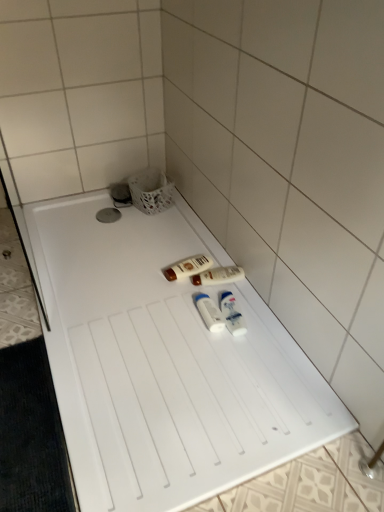
The image size is (384, 512). What are the coordinates of `white glossy lotion at center, acting as the second toiletry starting from the back` in the screenshot? It's located at (218, 276).

Is point (221, 322) closer to viewer compared to point (207, 259)?

Yes, it is.

Is white plastic tubes at center, which is counted as the second toiletry, starting from the front, positioned with its back to matte brown lotion at center, which is counted as the 4th toiletry, starting from the front?

No.

Is white plastic tubes at center, placed as the 3th toiletry when sorted from back to front, not close to matte brown lotion at center, which is counted as the 4th toiletry, starting from the front?

white plastic tubes at center, placed as the 3th toiletry when sorted from back to front, is near matte brown lotion at center, which is counted as the 4th toiletry, starting from the front, not far away.

From the image's perspective, relative to white plastic tubes at center, which is counted as the second toiletry, starting from the front, is white plastic bottles at center, the 1th toiletry from the front, above or below?

From the image's perspective, white plastic bottles at center, the 1th toiletry from the front, appears below white plastic tubes at center, which is counted as the second toiletry, starting from the front.

Between white plastic bottles at center, the 1th toiletry from the front, and white plastic tubes at center, placed as the 3th toiletry when sorted from back to front, which one has smaller size?

Smaller between the two is white plastic bottles at center, the 1th toiletry from the front.

Considering the relative positions of white plastic bottles at center, the 1th toiletry from the front, and white plastic tubes at center, which is counted as the second toiletry, starting from the front, in the image provided, is white plastic bottles at center, the 1th toiletry from the front, to the right of white plastic tubes at center, which is counted as the second toiletry, starting from the front, from the viewer's perspective?

Yes.

Consider the image. Considering the sizes of objects white plastic bottles at center, the fourth toiletry positioned from the back, and white plastic tubes at center, placed as the 3th toiletry when sorted from back to front, in the image provided, who is taller, white plastic bottles at center, the fourth toiletry positioned from the back, or white plastic tubes at center, placed as the 3th toiletry when sorted from back to front,?

white plastic tubes at center, placed as the 3th toiletry when sorted from back to front.

Is white plastic bottles at center, the 1th toiletry from the front, turned away from matte brown lotion at center, which is counted as the 4th toiletry, starting from the front?

No, white plastic bottles at center, the 1th toiletry from the front,'s orientation is not away from matte brown lotion at center, which is counted as the 4th toiletry, starting from the front.

From a real-world perspective, is white plastic bottles at center, the fourth toiletry positioned from the back, physically above matte brown lotion at center, placed as the first toiletry when sorted from back to front?

Correct, in the physical world, white plastic bottles at center, the fourth toiletry positioned from the back, is higher than matte brown lotion at center, placed as the first toiletry when sorted from back to front.

Which is closer, (242, 332) or (198, 268)?

The point (242, 332) is closer.

From the image's perspective, is white plastic tubes at center, placed as the 3th toiletry when sorted from back to front, located above or below white plastic bottles at center, the fourth toiletry positioned from the back?

From the image's perspective, white plastic tubes at center, placed as the 3th toiletry when sorted from back to front, appears above white plastic bottles at center, the fourth toiletry positioned from the back.

Is white plastic tubes at center, placed as the 3th toiletry when sorted from back to front, bigger than white plastic bottles at center, the fourth toiletry positioned from the back?

Indeed, white plastic tubes at center, placed as the 3th toiletry when sorted from back to front, has a larger size compared to white plastic bottles at center, the fourth toiletry positioned from the back.

Is white plastic tubes at center, which is counted as the second toiletry, starting from the front, further to camera compared to white plastic bottles at center, the fourth toiletry positioned from the back?

Yes, it is behind white plastic bottles at center, the fourth toiletry positioned from the back.

Is white plastic tubes at center, placed as the 3th toiletry when sorted from back to front, taller or shorter than white plastic bottles at center, the 1th toiletry from the front?

Considering their sizes, white plastic tubes at center, placed as the 3th toiletry when sorted from back to front, has more height than white plastic bottles at center, the 1th toiletry from the front.

From the picture: Is white glossy lotion at center, the third toiletry from the front, far away from matte brown lotion at center, placed as the first toiletry when sorted from back to front?

white glossy lotion at center, the third toiletry from the front, is actually quite close to matte brown lotion at center, placed as the first toiletry when sorted from back to front.

In the image, is white glossy lotion at center, the third toiletry from the front, on the left side or the right side of matte brown lotion at center, which is counted as the 4th toiletry, starting from the front?

white glossy lotion at center, the third toiletry from the front, is to the right of matte brown lotion at center, which is counted as the 4th toiletry, starting from the front.

Who is shorter, white glossy lotion at center, the third toiletry from the front, or matte brown lotion at center, which is counted as the 4th toiletry, starting from the front?

With less height is matte brown lotion at center, which is counted as the 4th toiletry, starting from the front.

Is white glossy lotion at center, acting as the second toiletry starting from the back, smaller than matte brown lotion at center, which is counted as the 4th toiletry, starting from the front?

No.

Is the depth of white plastic tray at center less than that of white plastic bottles at center, the 1th toiletry from the front?

Yes, white plastic tray at center is closer to the camera.

How distant is white plastic tray at center from white plastic bottles at center, the 1th toiletry from the front?

They are 33.56 centimeters apart.

Is white plastic tray at center wider than white plastic bottles at center, the 1th toiletry from the front?

Correct, the width of white plastic tray at center exceeds that of white plastic bottles at center, the 1th toiletry from the front.

Does white plastic tray at center touch white plastic bottles at center, the fourth toiletry positioned from the back?

No.

From the image's perspective, which one is positioned lower, matte brown lotion at center, which is counted as the 4th toiletry, starting from the front, or white plastic tubes at center, which is counted as the second toiletry, starting from the front?

white plastic tubes at center, which is counted as the second toiletry, starting from the front, is shown below in the image.

Between matte brown lotion at center, placed as the first toiletry when sorted from back to front, and white plastic tubes at center, placed as the 3th toiletry when sorted from back to front, which one is positioned in front?

white plastic tubes at center, placed as the 3th toiletry when sorted from back to front, is closer to the camera.

Is matte brown lotion at center, placed as the first toiletry when sorted from back to front, turned away from white plastic tubes at center, which is counted as the second toiletry, starting from the front?

That's not correct — matte brown lotion at center, placed as the first toiletry when sorted from back to front, is not looking away from white plastic tubes at center, which is counted as the second toiletry, starting from the front.

From a real-world perspective, relative to white plastic tubes at center, placed as the 3th toiletry when sorted from back to front, is matte brown lotion at center, which is counted as the 4th toiletry, starting from the front, vertically above or below?

matte brown lotion at center, which is counted as the 4th toiletry, starting from the front, is below white plastic tubes at center, placed as the 3th toiletry when sorted from back to front.

From the matte brown lotion at center, placed as the first toiletry when sorted from back to front, count 1st toiletry to the right and point to it. Please provide its 2D coordinates.

[(209, 312)]

The width and height of the screenshot is (384, 512). I want to click on toiletry positioned vertically above the white plastic bottles at center, the fourth toiletry positioned from the back (from a real-world perspective), so click(209, 312).

When comparing their distances from white glossy lotion at center, the third toiletry from the front, does white plastic tray at center or white plastic tubes at center, placed as the 3th toiletry when sorted from back to front, seem further?

white plastic tray at center.

When comparing their distances from white plastic tubes at center, placed as the 3th toiletry when sorted from back to front, does white glossy lotion at center, acting as the second toiletry starting from the back, or matte brown lotion at center, placed as the first toiletry when sorted from back to front, seem further?

matte brown lotion at center, placed as the first toiletry when sorted from back to front, lies further to white plastic tubes at center, placed as the 3th toiletry when sorted from back to front, than the other object.

Which object lies further to the anchor point white plastic tray at center, white plastic bottles at center, the 1th toiletry from the front, or white glossy lotion at center, the third toiletry from the front?

white glossy lotion at center, the third toiletry from the front, lies further to white plastic tray at center than the other object.

Looking at the image, which one is located further to white plastic bottles at center, the fourth toiletry positioned from the back, white plastic tubes at center, placed as the 3th toiletry when sorted from back to front, or white plastic tray at center?

Based on the image, white plastic tray at center appears to be further to white plastic bottles at center, the fourth toiletry positioned from the back.

Looking at the image, which one is located further to matte brown lotion at center, which is counted as the 4th toiletry, starting from the front, white plastic tubes at center, which is counted as the second toiletry, starting from the front, or white plastic bottles at center, the 1th toiletry from the front?

The object further to matte brown lotion at center, which is counted as the 4th toiletry, starting from the front, is white plastic bottles at center, the 1th toiletry from the front.

Based on their spatial positions, is white plastic tubes at center, placed as the 3th toiletry when sorted from back to front, or white plastic tray at center closer to white glossy lotion at center, the third toiletry from the front?

white plastic tubes at center, placed as the 3th toiletry when sorted from back to front.

Which object lies nearer to the anchor point matte brown lotion at center, which is counted as the 4th toiletry, starting from the front, white glossy lotion at center, acting as the second toiletry starting from the back, or white plastic tray at center?

white glossy lotion at center, acting as the second toiletry starting from the back, is positioned closer to the anchor matte brown lotion at center, which is counted as the 4th toiletry, starting from the front.

When comparing their distances from white plastic tray at center, does white plastic bottles at center, the 1th toiletry from the front, or matte brown lotion at center, placed as the first toiletry when sorted from back to front, seem further?

matte brown lotion at center, placed as the first toiletry when sorted from back to front, is positioned further to the anchor white plastic tray at center.

At what (x,y) coordinates should I click in order to perform the action: click on toiletry between white plastic tubes at center, which is counted as the second toiletry, starting from the front, and matte brown lotion at center, which is counted as the 4th toiletry, starting from the front, from front to back. Please return your answer as a coordinate pair (x, y). Looking at the image, I should click on (218, 276).

You are a GUI agent. You are given a task and a screenshot of the screen. Output one action in this format:
    pyautogui.click(x=<x>, y=<y>)
    Task: Click on the toiletry between white plastic bottles at center, the fourth toiletry positioned from the back, and white glossy lotion at center, the third toiletry from the front, in the front-back direction
    The image size is (384, 512).
    Given the screenshot: What is the action you would take?
    pyautogui.click(x=209, y=312)

Locate an element on the screen. This screenshot has width=384, height=512. toiletry located between white plastic tray at center and white plastic tubes at center, placed as the 3th toiletry when sorted from back to front, in the depth direction is located at coordinates (232, 314).